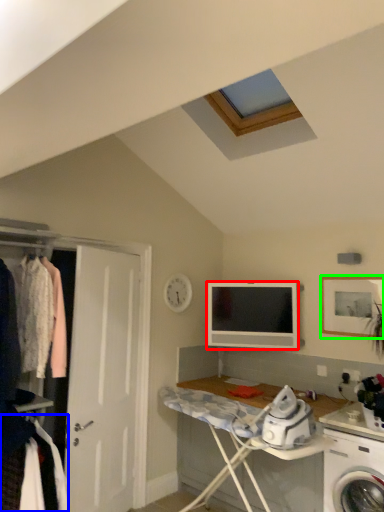
Question: Which object is positioned farthest from television (highlighted by a red box)? Select from clothing (highlighted by a blue box) and picture frame (highlighted by a green box).

Choices:
 (A) clothing
 (B) picture frame

Answer: (A)